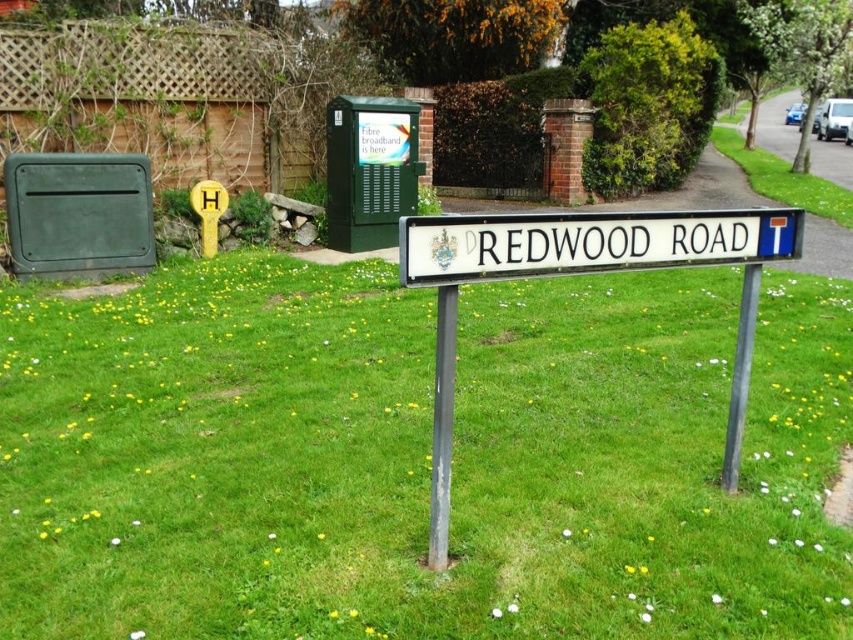
Question: Does white plastic sign at center have a smaller size compared to black metal pole at center?

Choices:
 (A) no
 (B) yes

Answer: (A)

Question: Does green grass at center appear on the right side of white plastic street sign at center?

Choices:
 (A) no
 (B) yes

Answer: (A)

Question: Which point is closer to the camera?

Choices:
 (A) (450, 355)
 (B) (723, 483)

Answer: (A)

Question: Which point is closer to the camera?

Choices:
 (A) [x=444, y=317]
 (B) [x=764, y=218]

Answer: (A)

Question: Based on their relative distances, which object is farther from the white plastic street sign at center?

Choices:
 (A) black metal pole at center
 (B) white plastic sign at center

Answer: (A)

Question: Is white plastic street sign at center to the left of white plastic sign at center from the viewer's perspective?

Choices:
 (A) no
 (B) yes

Answer: (B)